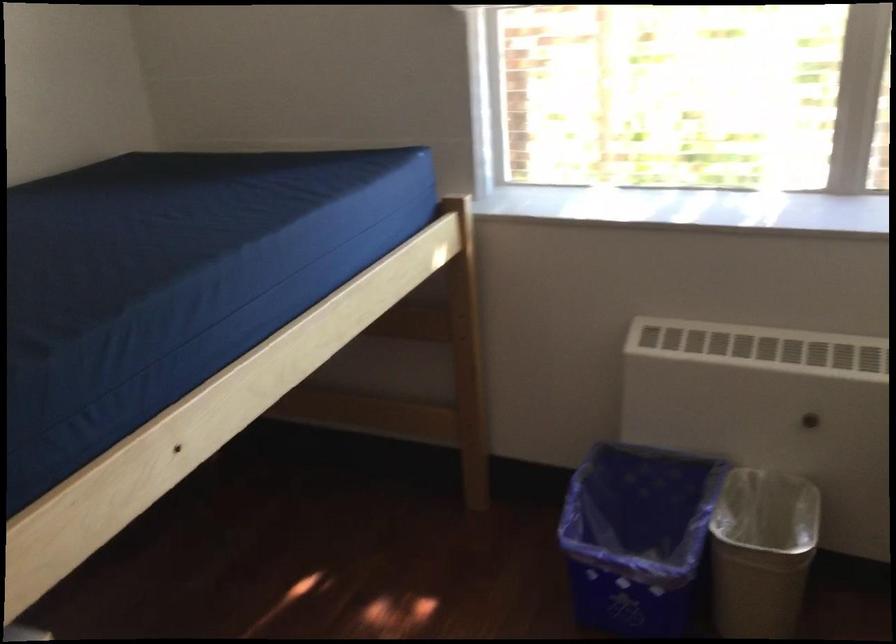
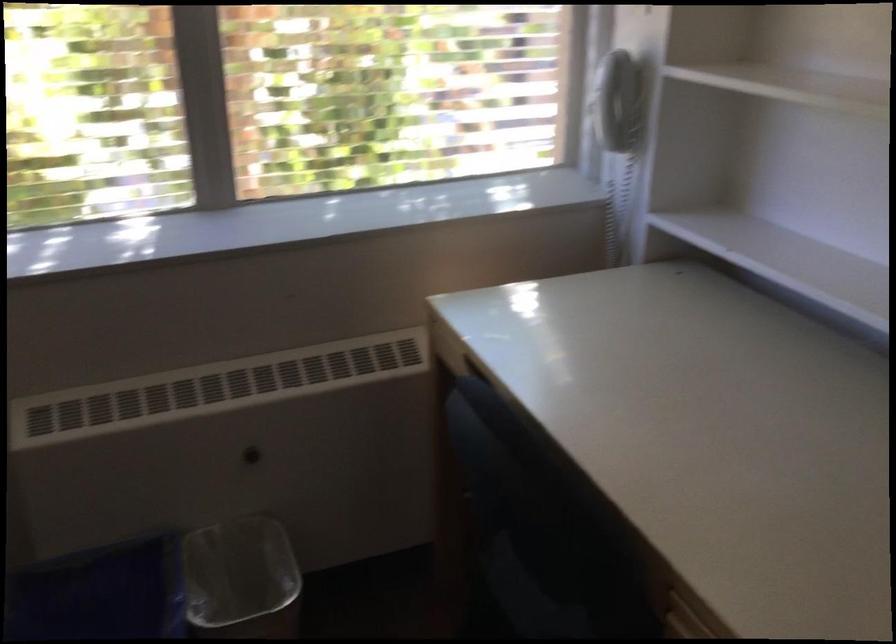
Question: The first image is from the beginning of the video and the second image is from the end. How did the camera likely rotate when shooting the video?

Choices:
 (A) Left
 (B) Right
 (C) Up
 (D) Down

Answer: (B)